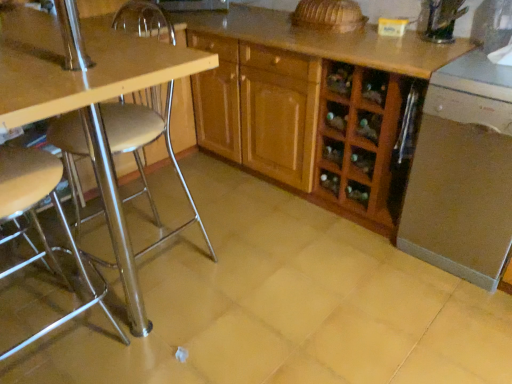
Find the location of `vacant area that lies between wooden table at left and metallic silver stool at left`. vacant area that lies between wooden table at left and metallic silver stool at left is located at coordinates (138, 316).